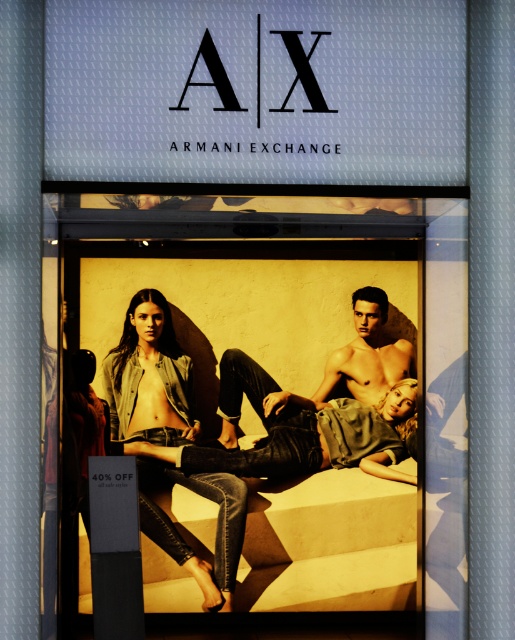
You are a customer looking at the Armani Exchange store window display. You see the denim jeans at center and the denim jacket at center. Which item is placed higher in the display?

The denim jeans at center is positioned over the denim jacket at center, so the jeans are placed higher in the display.